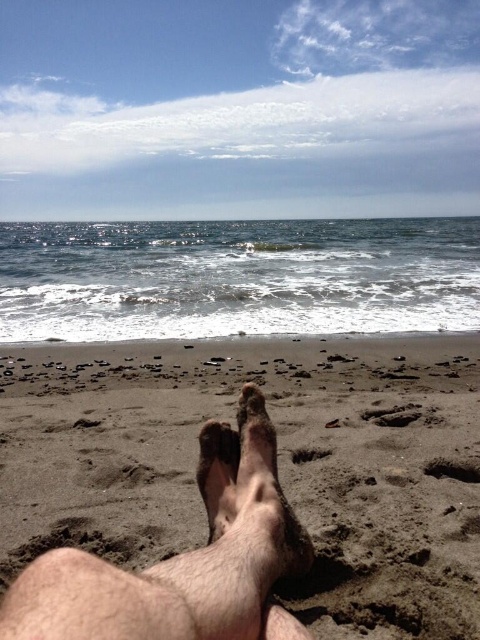
Question: Is brown sandy feet at lower center thinner than dry sand foot at center?

Choices:
 (A) yes
 (B) no

Answer: (B)

Question: Can you confirm if brown sandy feet at lower center is bigger than dry sand foot at center?

Choices:
 (A) no
 (B) yes

Answer: (B)

Question: Does brown sandy feet at lower center appear on the right side of dry sand foot at center?

Choices:
 (A) yes
 (B) no

Answer: (B)

Question: Which point appears closest to the camera in this image?

Choices:
 (A) (225, 509)
 (B) (59, 358)

Answer: (A)

Question: Which of the following is the closest to the observer?

Choices:
 (A) dry sand foot at center
 (B) brown sandy feet at lower center

Answer: (A)